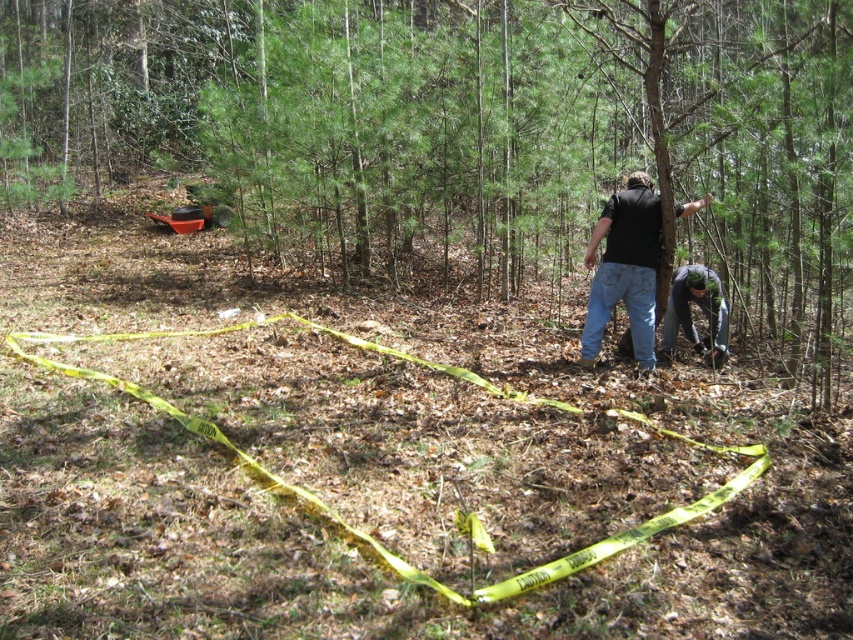
Question: Which of these objects is positioned farthest from the green textured tree at center?

Choices:
 (A) dark gray fabric at lower right
 (B) black matte shirt at center

Answer: (B)

Question: Which object is the farthest from the dark gray fabric at lower right?

Choices:
 (A) green textured tree at center
 (B) black matte shirt at center

Answer: (A)

Question: Can you confirm if black matte shirt at center is positioned to the left of dark gray fabric at lower right?

Choices:
 (A) yes
 (B) no

Answer: (A)

Question: Which point is farther to the camera?

Choices:
 (A) (430, 45)
 (B) (718, 339)
 (C) (589, 298)

Answer: (A)

Question: Can you confirm if green textured tree at center is smaller than black matte shirt at center?

Choices:
 (A) yes
 (B) no

Answer: (B)

Question: Is black matte shirt at center positioned at the back of dark gray fabric at lower right?

Choices:
 (A) yes
 (B) no

Answer: (B)